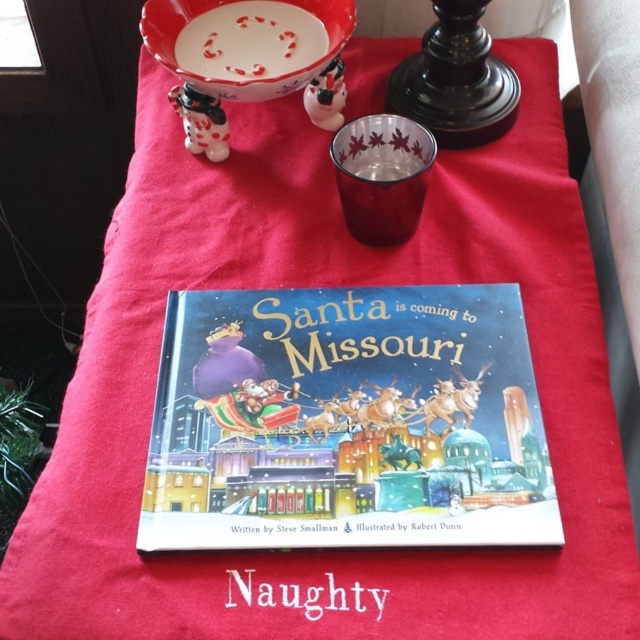
You are standing 54.34 centimeters away from the point at coordinates (394, 387). Can you reach the book titled Santa is coming to Missouri without moving your feet?

The point at coordinates (394, 387) is 54.34 centimeters away from you. Since the book is located at the center of the table, which is likely within arm reach, you can probably reach it without moving your feet.